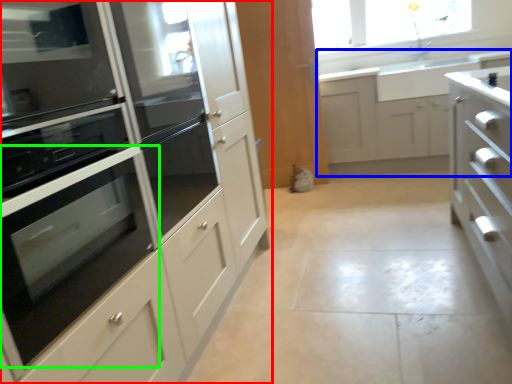
Question: Estimate the real-world distances between objects in this image. Which object is closer to cabinetry (highlighted by a red box), cabinetry (highlighted by a blue box) or oven (highlighted by a green box)?

Choices:
 (A) cabinetry
 (B) oven

Answer: (B)